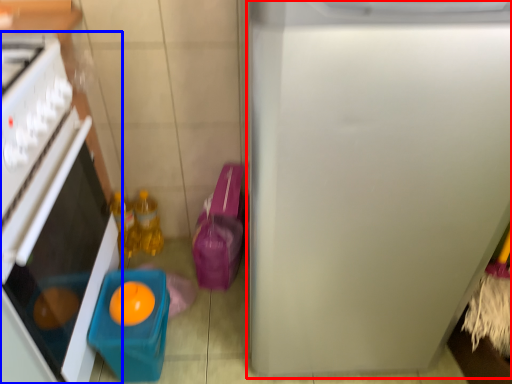
Question: Among these objects, which one is nearest to the camera, refrigerator (highlighted by a red box) or home appliance (highlighted by a blue box)?

Choices:
 (A) refrigerator
 (B) home appliance

Answer: (A)